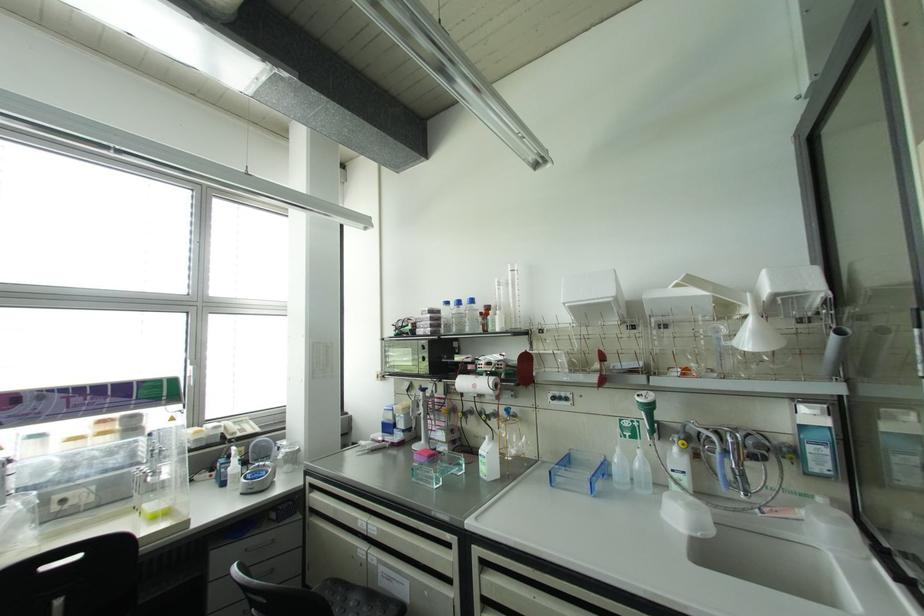
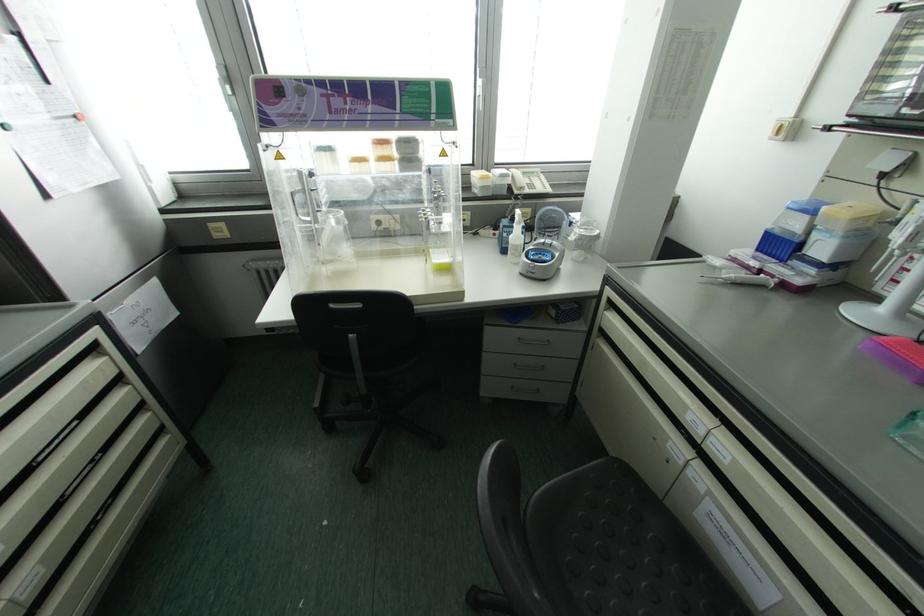
Find the pixel in the second image that matches [223,484] in the first image.

(504, 251)